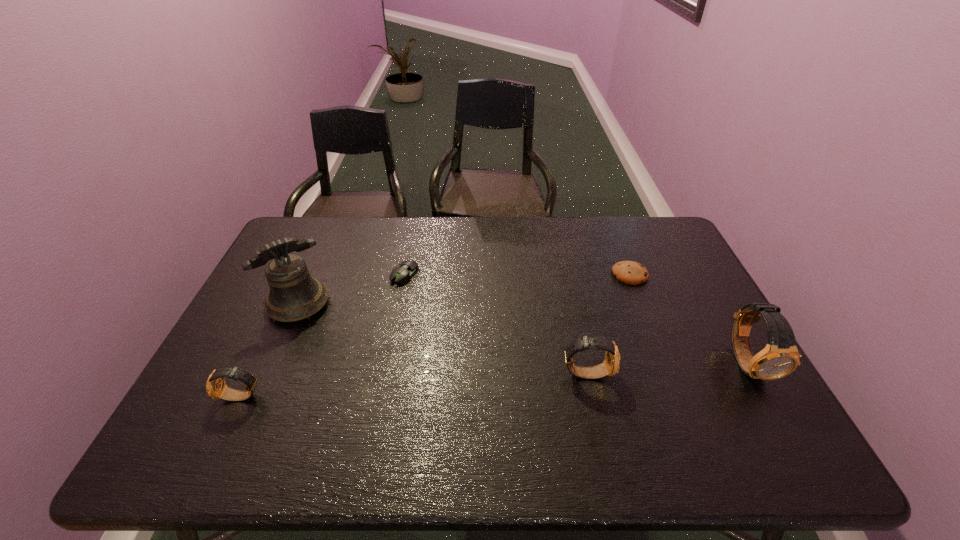
Find the location of `vacant space at the near edge`. vacant space at the near edge is located at coordinates (290, 392).

Where is `vacant space at the left edge`? The image size is (960, 540). vacant space at the left edge is located at coordinates (233, 329).

Where is `vacant point located between the fourth object from right to left and the second tallest watch`? This screenshot has height=540, width=960. vacant point located between the fourth object from right to left and the second tallest watch is located at coordinates (496, 324).

Locate an element on the screen. This screenshot has width=960, height=540. free space between the fourth object from right to left and the tallest object is located at coordinates (352, 289).

Locate an element on the screen. This screenshot has height=540, width=960. vacant space that's between the tallest object and the cookie is located at coordinates (465, 289).

Where is `free spot between the fourth object from left to right and the cookie`? This screenshot has height=540, width=960. free spot between the fourth object from left to right and the cookie is located at coordinates (608, 324).

Identify the location of vacant point located between the computer mouse and the shortest watch. The width and height of the screenshot is (960, 540). (324, 336).

The width and height of the screenshot is (960, 540). Find the location of `vacant area between the fourth shortest object and the computer mouse`. vacant area between the fourth shortest object and the computer mouse is located at coordinates (496, 324).

I want to click on free space between the second watch from right to left and the fourth object from right to left, so click(496, 324).

In order to click on free space between the computer mouse and the fourth tallest object in this screenshot , I will do `click(324, 336)`.